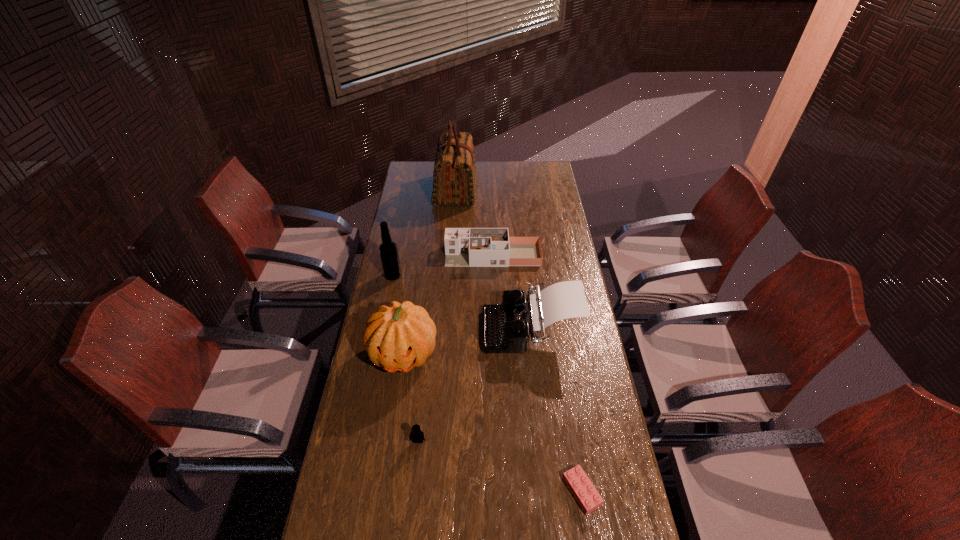
This screenshot has width=960, height=540. In the image, there is a desktop. Find the location of `free space at the far left corner`. free space at the far left corner is located at coordinates (416, 168).

Where is `free space at the far right corner of the desktop`? The height and width of the screenshot is (540, 960). free space at the far right corner of the desktop is located at coordinates (530, 161).

Where is `empty space between the fifth nearest object and the shopping bag`? empty space between the fifth nearest object and the shopping bag is located at coordinates (424, 233).

Where is `vacant point located between the beer bottle and the second farthest object`? vacant point located between the beer bottle and the second farthest object is located at coordinates [443, 266].

Identify the location of free point between the shortest object and the sixth nearest object. The width and height of the screenshot is (960, 540). (537, 374).

You are a GUI agent. You are given a task and a screenshot of the screen. Output one action in this format:
    pyautogui.click(x=<x>, y=<y>)
    Task: Click on the free space between the right Lego and the pumpkin
    The width and height of the screenshot is (960, 540).
    Given the screenshot: What is the action you would take?
    point(492,423)

Image resolution: width=960 pixels, height=540 pixels. I want to click on free space between the typewriter and the second nearest object, so click(x=474, y=385).

Identify the location of free space between the farthest object and the sixth nearest object. This screenshot has width=960, height=540. (474, 223).

Find the location of a particular element. The width and height of the screenshot is (960, 540). free point between the fifth nearest object and the typewriter is located at coordinates (462, 302).

Find the location of a particular element. The width and height of the screenshot is (960, 540). vacant area that lies between the fourth shortest object and the nearest object is located at coordinates (556, 410).